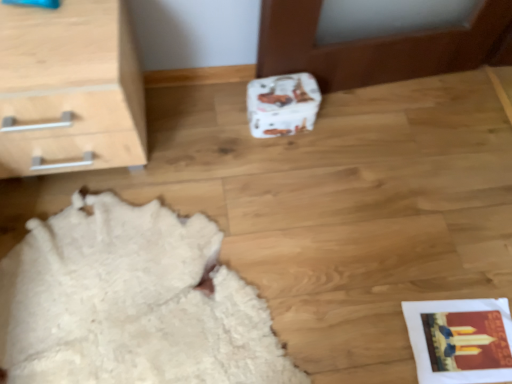
Find the location of a particular element. This screenshot has width=512, height=384. vacant region under white fluffy rug at lower left (from a real-world perspective) is located at coordinates (146, 280).